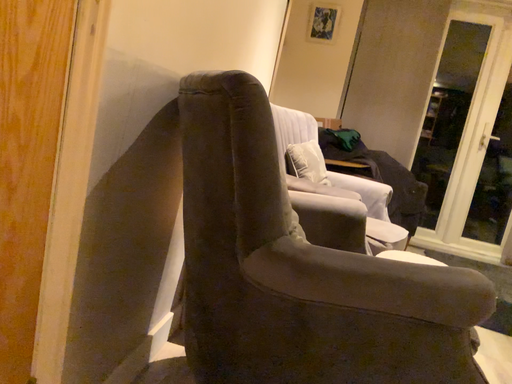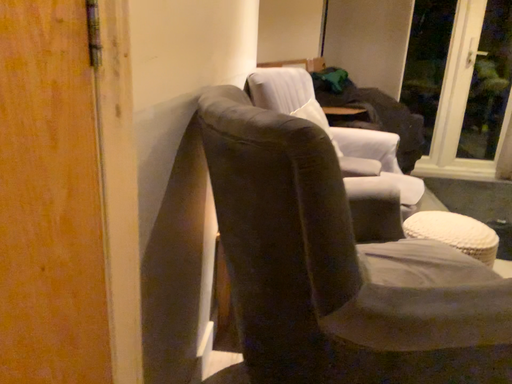
Question: Which way did the camera rotate in the video?

Choices:
 (A) rotated upward
 (B) rotated downward

Answer: (B)